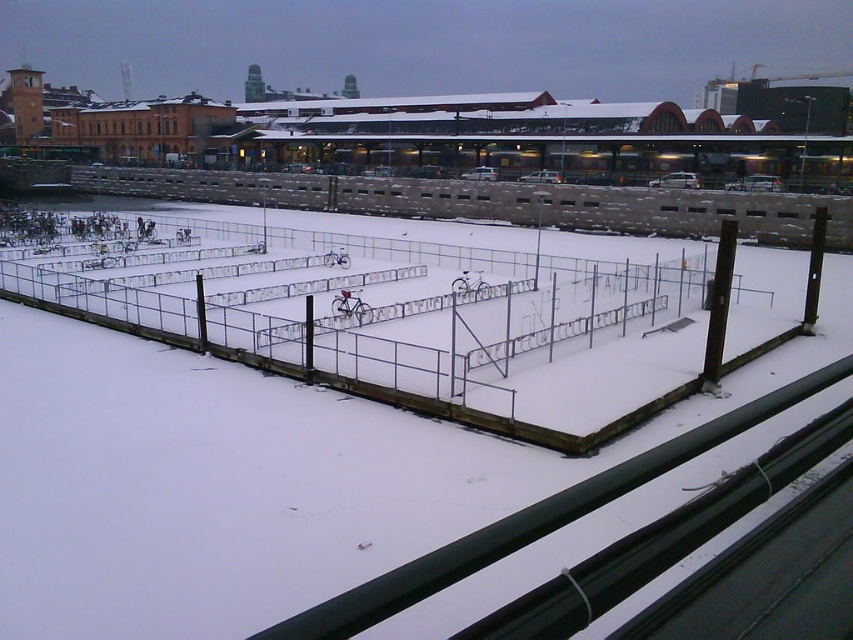
Question: Observing the image, what is the correct spatial positioning of metallic silver fence at center in reference to brown concrete fence at upper center?

Choices:
 (A) left
 (B) right

Answer: (B)

Question: Which point is farther to the camera?

Choices:
 (A) metallic silver fence at center
 (B) brown concrete fence at upper center

Answer: (B)

Question: Is metallic silver fence at center thinner than brown concrete fence at upper center?

Choices:
 (A) yes
 (B) no

Answer: (A)

Question: Is metallic silver fence at center to the left of brown concrete fence at upper center from the viewer's perspective?

Choices:
 (A) yes
 (B) no

Answer: (B)

Question: Which object appears closest to the camera in this image?

Choices:
 (A) brown concrete fence at upper center
 (B) metallic silver fence at center

Answer: (B)

Question: Which point is farther from the camera taking this photo?

Choices:
 (A) (599, 384)
 (B) (194, 189)

Answer: (B)